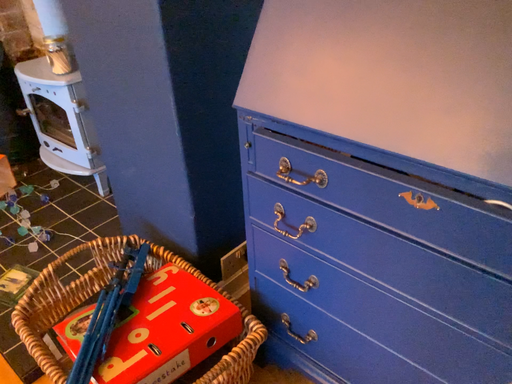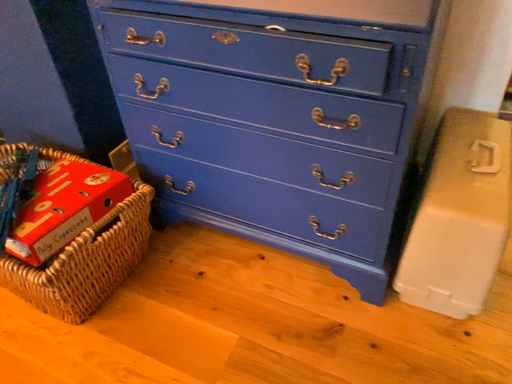
Question: How did the camera likely rotate when shooting the video?

Choices:
 (A) rotated right
 (B) rotated left

Answer: (A)